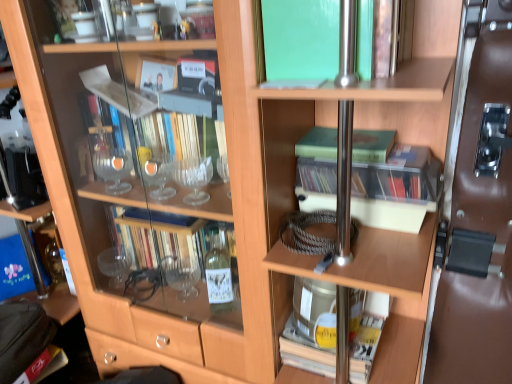
Identify the location of free spot above translucent plastic case at center, which ranks as the 3th book in bottom-to-top order (from a real-world perspective). The width and height of the screenshot is (512, 384). (399, 156).